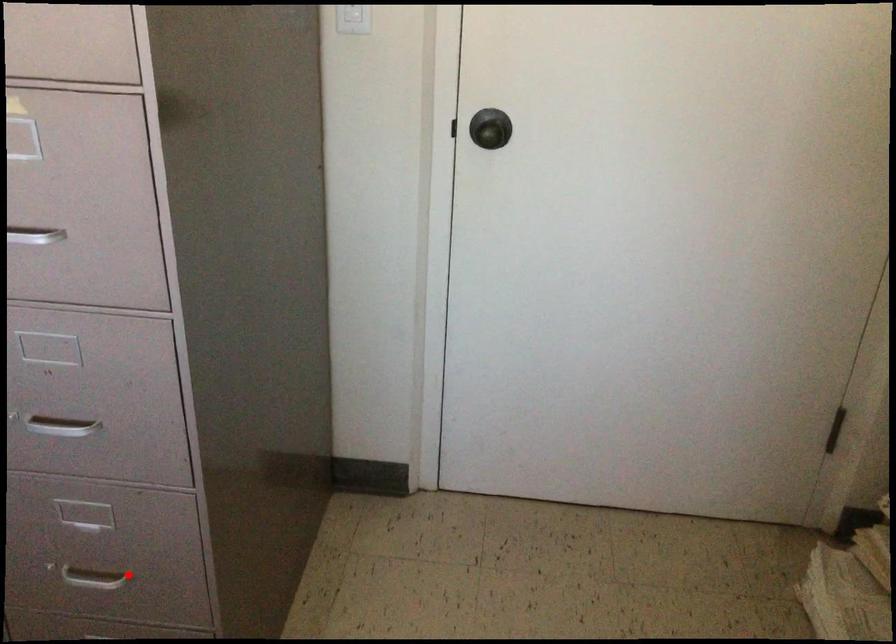
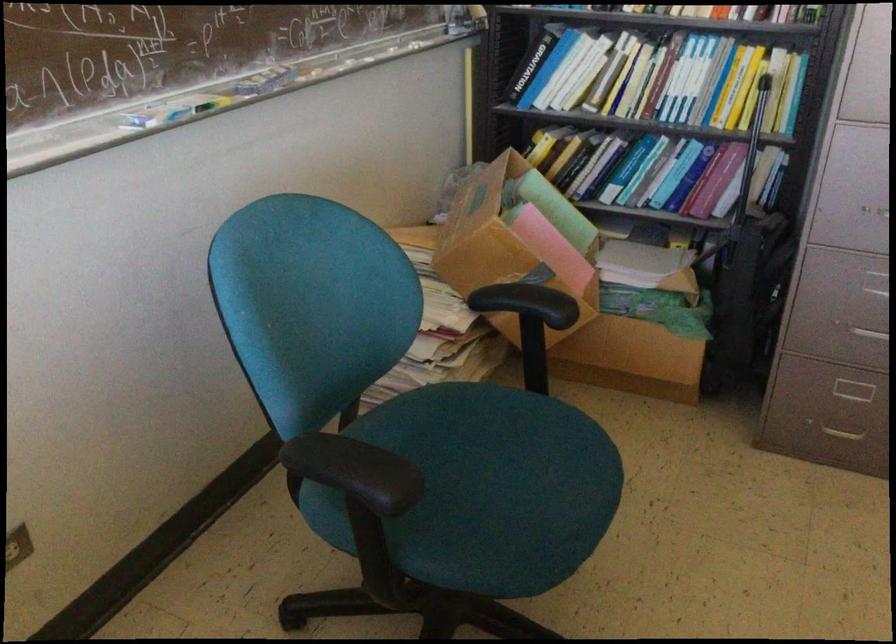
Question: I am providing you with two images of the same scene from different viewpoints. A red point is shown in image1. For the corresponding object point in image2, is it positioned nearer or farther from the camera?

Choices:
 (A) Nearer
 (B) Farther

Answer: (B)